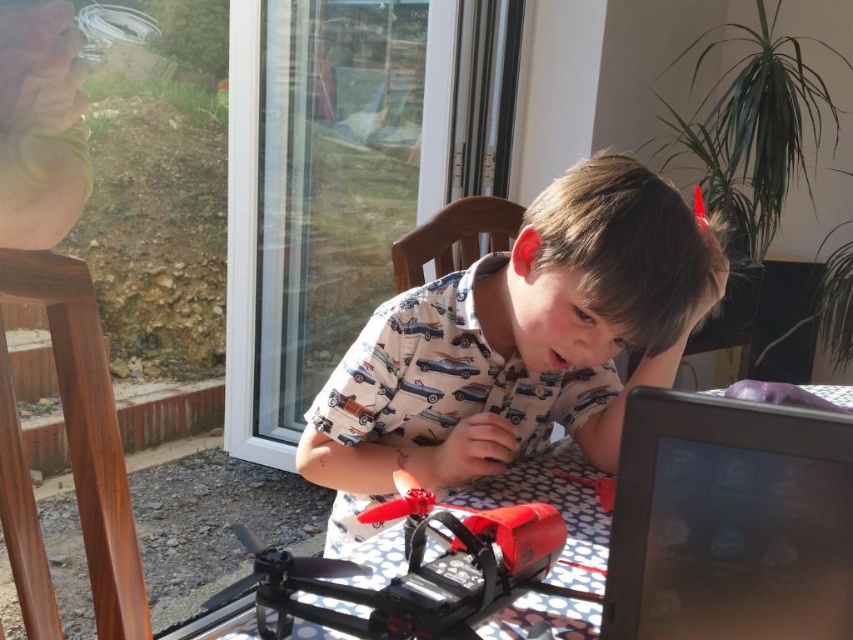
Question: Which object is closer to the camera taking this photo?

Choices:
 (A) black glossy tablet at lower right
 (B) transparent glass screen door at upper center
 (C) matte black drone at center
 (D) shiny red drone at center

Answer: (A)

Question: Can you confirm if transparent glass screen door at upper center is bigger than white cotton shirt at center?

Choices:
 (A) no
 (B) yes

Answer: (B)

Question: From the image, what is the correct spatial relationship of black glossy tablet at lower right in relation to shiny red drone at center?

Choices:
 (A) right
 (B) left

Answer: (A)

Question: Which point is farther to the camera?

Choices:
 (A) (450, 611)
 (B) (807, 541)

Answer: (A)

Question: Does white cotton shirt at center have a lesser width compared to shiny red drone at center?

Choices:
 (A) yes
 (B) no

Answer: (B)

Question: Which point is closer to the camera taking this photo?

Choices:
 (A) (219, 634)
 (B) (813, 577)
 (C) (368, 577)

Answer: (B)